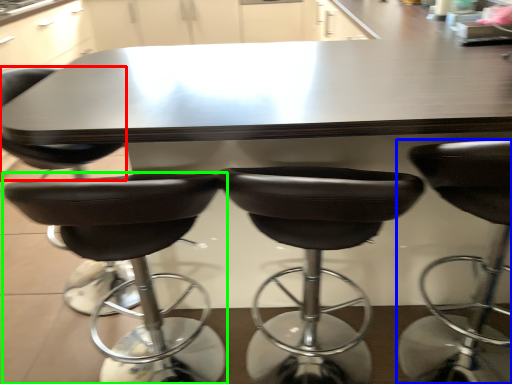
Question: Which is farther away from chair (highlighted by a red box)? chair (highlighted by a blue box) or chair (highlighted by a green box)?

Choices:
 (A) chair
 (B) chair

Answer: (A)